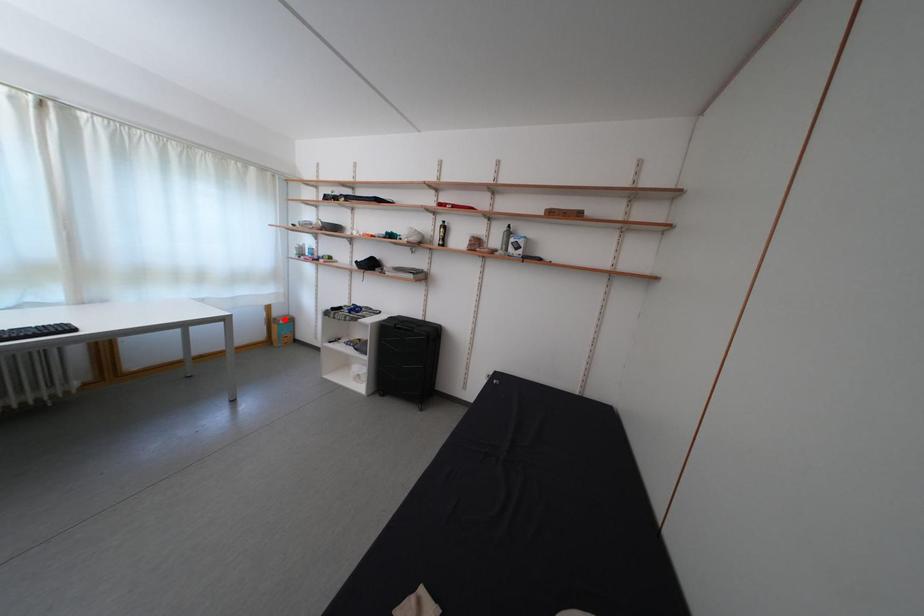
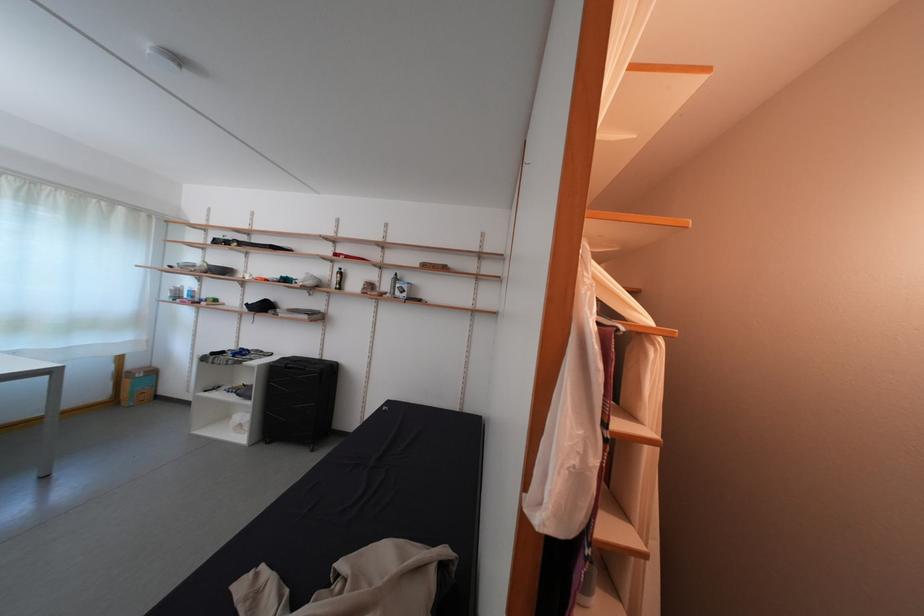
Question: I am providing you with two images of the same scene from different viewpoints. In image1, a red point is highlighted. Considering the same 3D point in image2, which of the following is correct?

Choices:
 (A) It is closer
 (B) It is farther

Answer: (A)